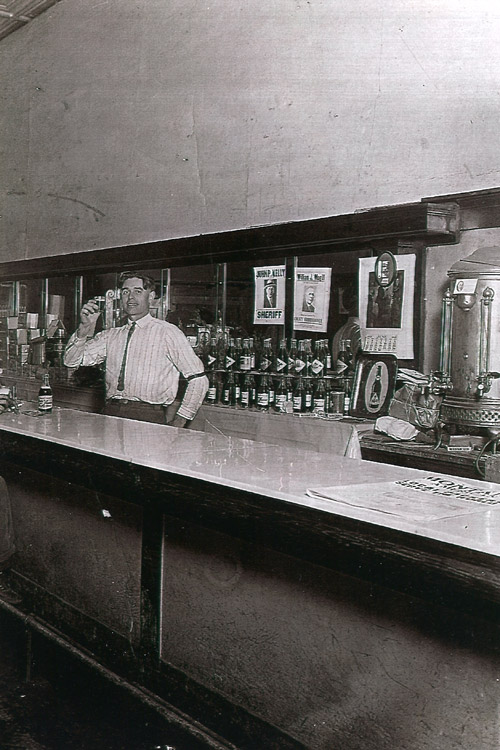
Locate an element on the screen. The width and height of the screenshot is (500, 750). wall is located at coordinates (251, 124).